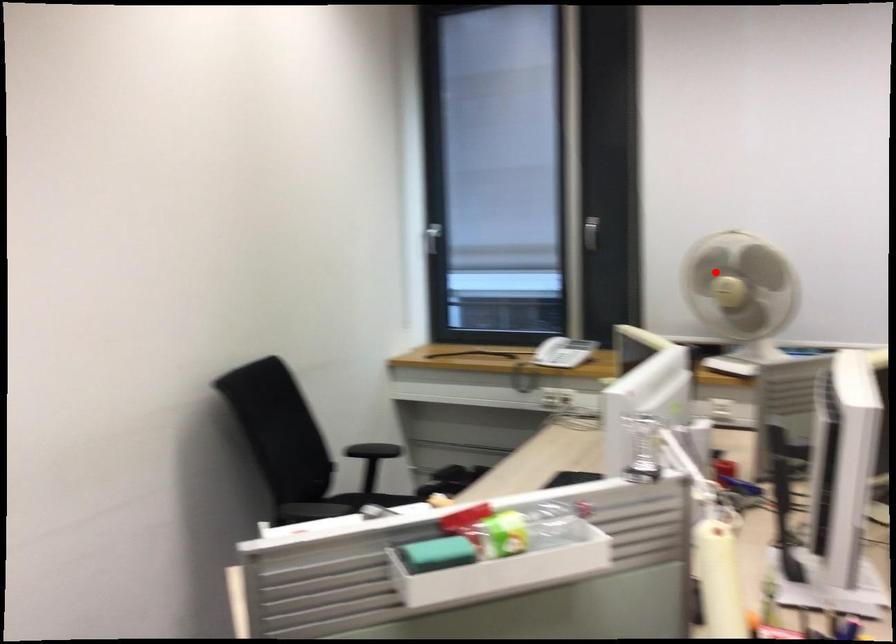
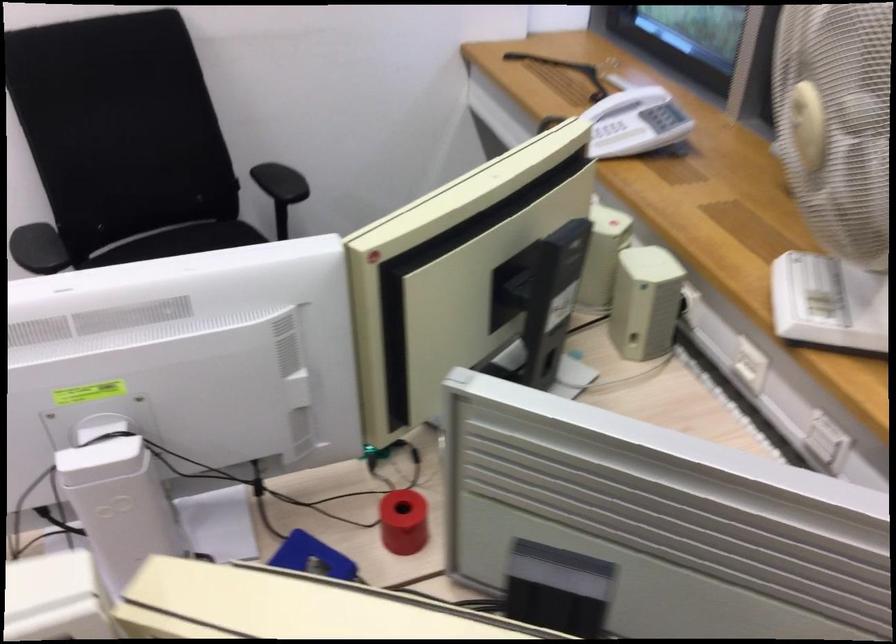
Question: I am providing you with two images of the same scene from different viewpoints. Image1 has a red point marked. In image2, the corresponding 3D location appears at what relative position? Reply with the corresponding letter.

Choices:
 (A) Closer
 (B) Farther

Answer: (A)